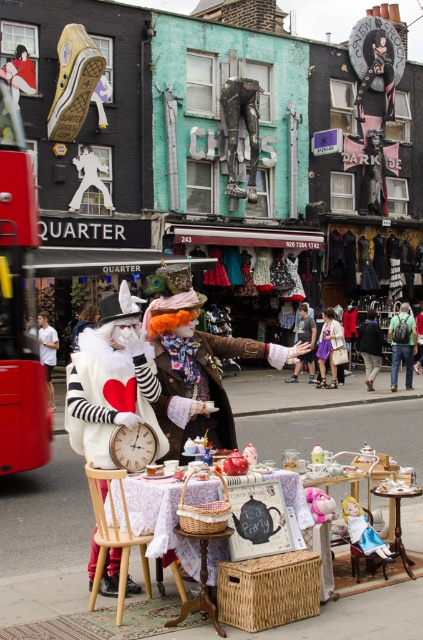
Question: Which of these objects is positioned closest to the pink plush unicorn at center?

Choices:
 (A) white cotton shirt at left
 (B) white plush alice at center

Answer: (B)

Question: Based on their relative distances, which object is farther from the light brown leather jacket at center?

Choices:
 (A) white cotton shirt at left
 (B) denim jacket at center
 (C) red rubber bus at left
 (D) wooden table at center

Answer: (C)

Question: Among these objects, which one is farthest from the camera?

Choices:
 (A) matte brown leather jacket at center
 (B) wooden table at center

Answer: (A)

Question: Can you confirm if wooden table at center is positioned to the right of white cotton shirt at left?

Choices:
 (A) yes
 (B) no

Answer: (A)

Question: Is wooden table at center positioned at the back of denim jacket at center?

Choices:
 (A) yes
 (B) no

Answer: (B)

Question: Is denim jacket at center behind white plush alice at center?

Choices:
 (A) yes
 (B) no

Answer: (A)